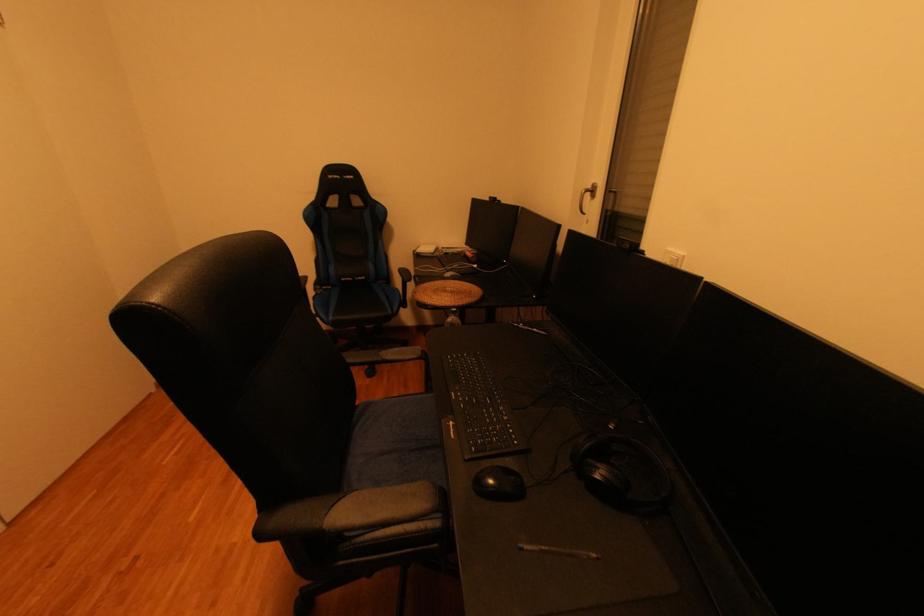
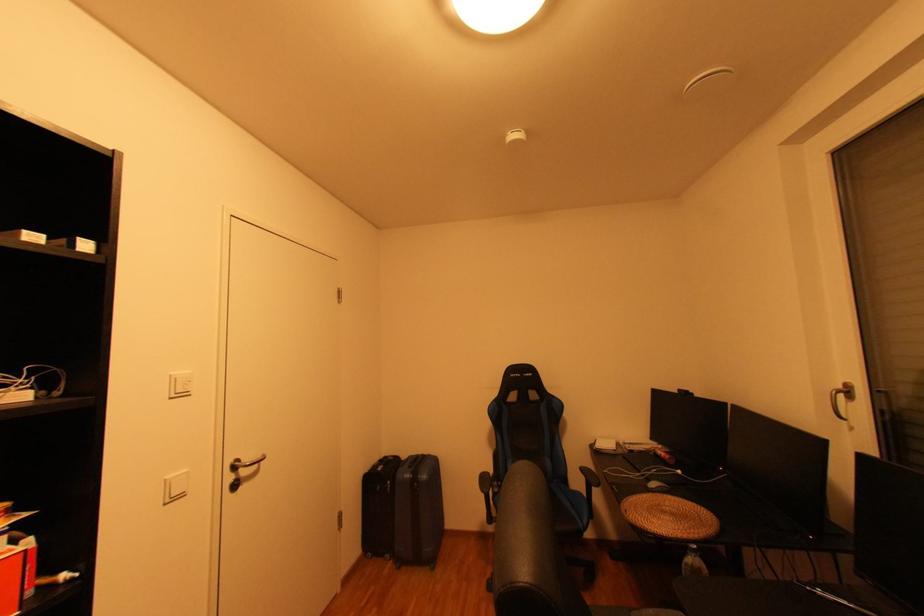
In the second image, find the point that corresponds to pixel 600 188 in the first image.

(849, 387)